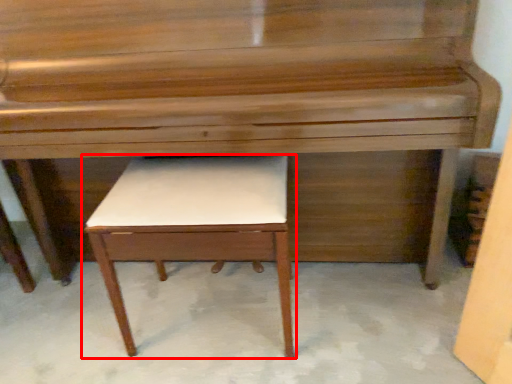
Question: From the image's perspective, what is the correct spatial positioning of table (annotated by the red box) in reference to piano?

Choices:
 (A) below
 (B) above

Answer: (A)